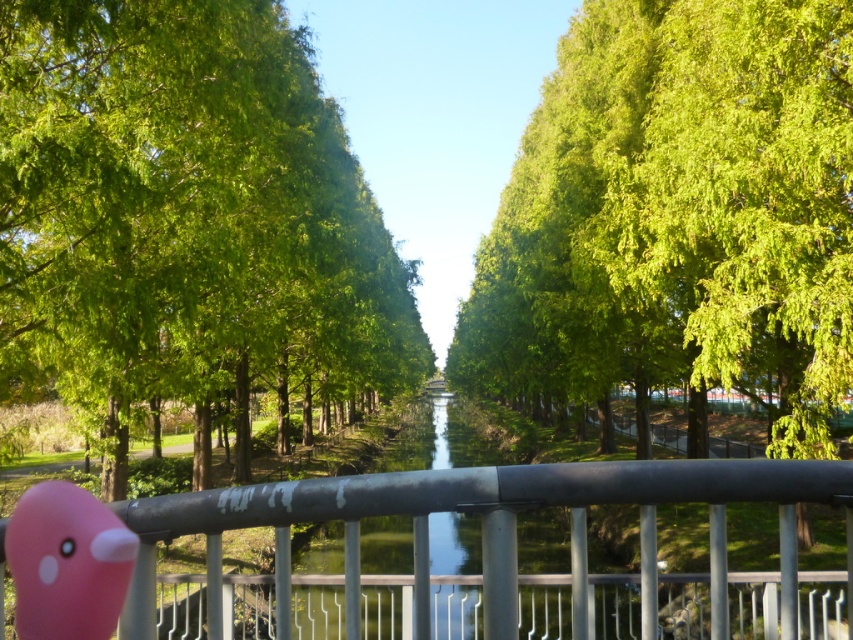
Who is shorter, green leafy trees at center or pink matte bird at lower left?

Standing shorter between the two is pink matte bird at lower left.

Based on the photo, does green leafy trees at center have a lesser height compared to pink matte bird at lower left?

In fact, green leafy trees at center may be taller than pink matte bird at lower left.

Who is more distant from viewer, [254,268] or [49,584]?

The point [254,268] is behind.

Find the location of a particular element. The width and height of the screenshot is (853, 640). green leafy trees at center is located at coordinates (184, 220).

Who is taller, metallic gray railing at center or pink matte bird at lower left?

metallic gray railing at center

Does metallic gray railing at center have a lesser height compared to pink matte bird at lower left?

No.

Who is more forward, (245, 573) or (42, 513)?

Point (42, 513) is more forward.

This screenshot has width=853, height=640. What are the coordinates of `metallic gray railing at center` in the screenshot? It's located at (491, 557).

Is green leafy tree at center to the left of metallic gray railing at center from the viewer's perspective?

Incorrect, green leafy tree at center is not on the left side of metallic gray railing at center.

Can you confirm if green leafy tree at center is positioned above metallic gray railing at center?

Yes, green leafy tree at center is above metallic gray railing at center.

This screenshot has height=640, width=853. In order to click on green leafy tree at center in this screenshot , I will do `click(677, 218)`.